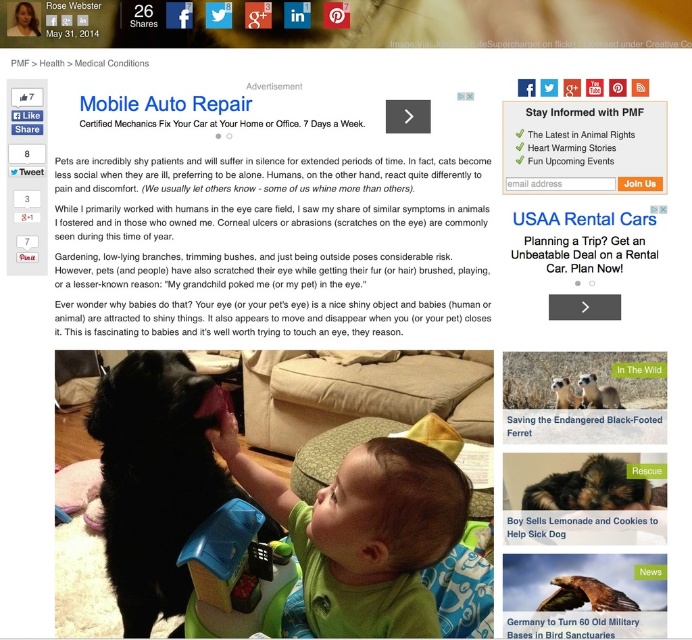
You are designing a layout for a pet care blog and need to place a new section about dog behavior. The current page has the white paper text at upper center. Where should you position the new section to ensure it doesn not overlap with the existing text?

The white paper text at upper center is located at point (107, 104), so you should position the new section away from that coordinate to avoid overlap.

Consider the image. You are a website designer reviewing this webpage. You notice the white paper text at upper center and the soft brown fur at center. Which element is positioned closer to the viewer?

The white paper text at upper center is closer to the viewer than the soft brown fur at center.

Based on the scene described, which object is taller when comparing the brown matte hair at center and the soft brown fur puppy at center?

The brown matte hair at center is taller than the soft brown fur puppy at center according to the description.